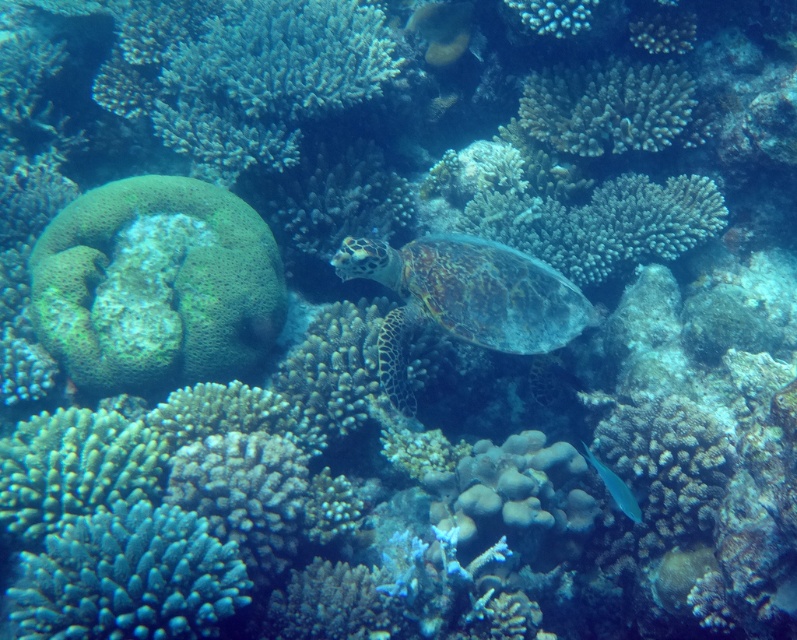
You are a marine biologist studying coral reefs. You notice a green porous coral at center and a rough textured coral at upper center in the image. Which coral is bigger in size?

The green porous coral at center is larger in size compared to the rough textured coral at upper center.

You are a marine biologist studying coral reefs. You observe the green porous coral at center and the rough textured coral at upper center in the underwater scene. Which coral is closer to you from your vantage point?

The green porous coral at center is closer to you because it is positioned in front of the rough textured coral at upper center.